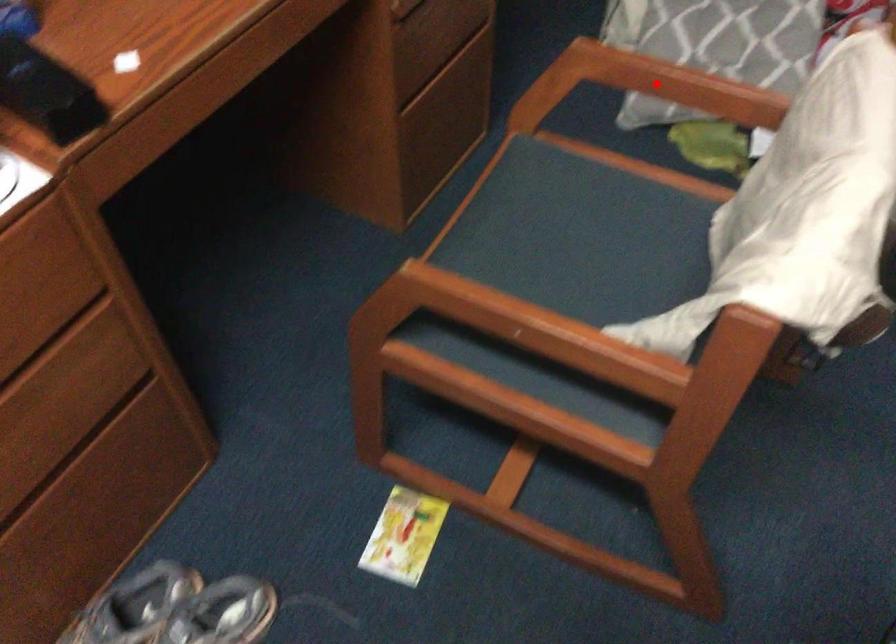
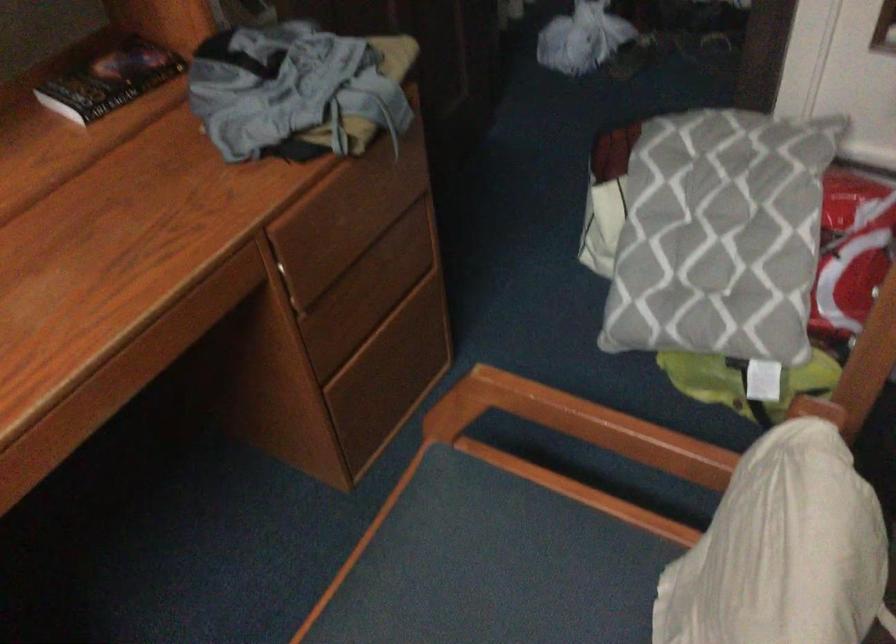
Question: I am providing you with two images of the same scene from different viewpoints. In image1, a red point is highlighted. Considering the same 3D point in image2, which of the following is correct?

Choices:
 (A) It is closer
 (B) It is farther

Answer: (A)